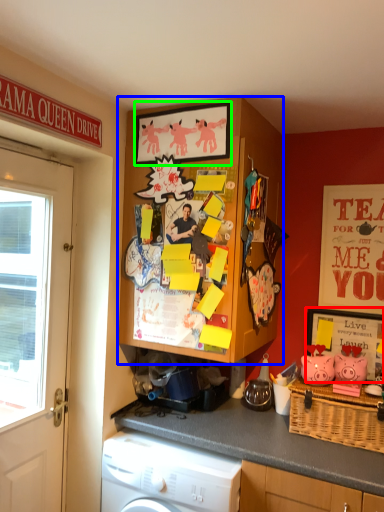
Question: Which object is the closest to the picture frame (highlighted by a red box)? Choose among these: cabinetry (highlighted by a blue box) or picture frame (highlighted by a green box).

Choices:
 (A) cabinetry
 (B) picture frame

Answer: (A)